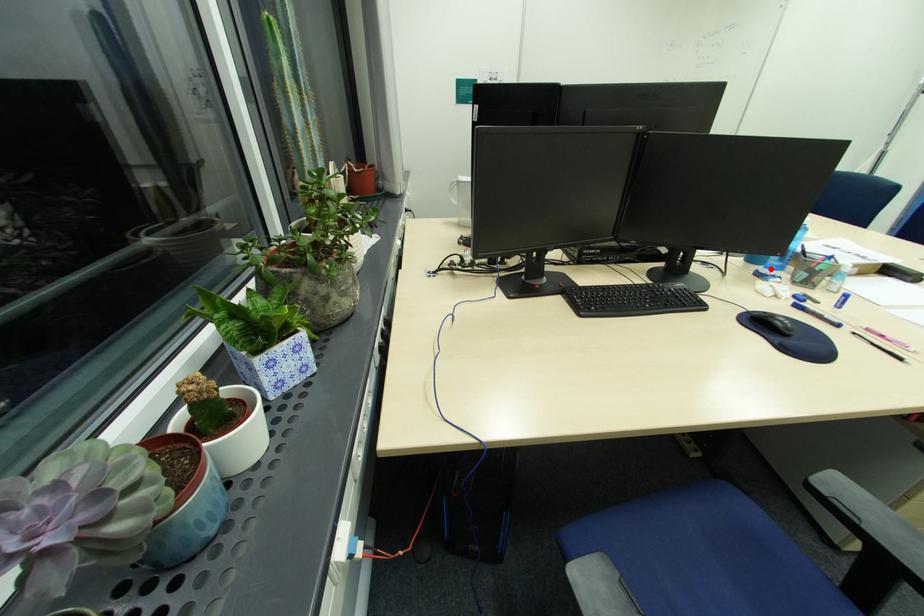
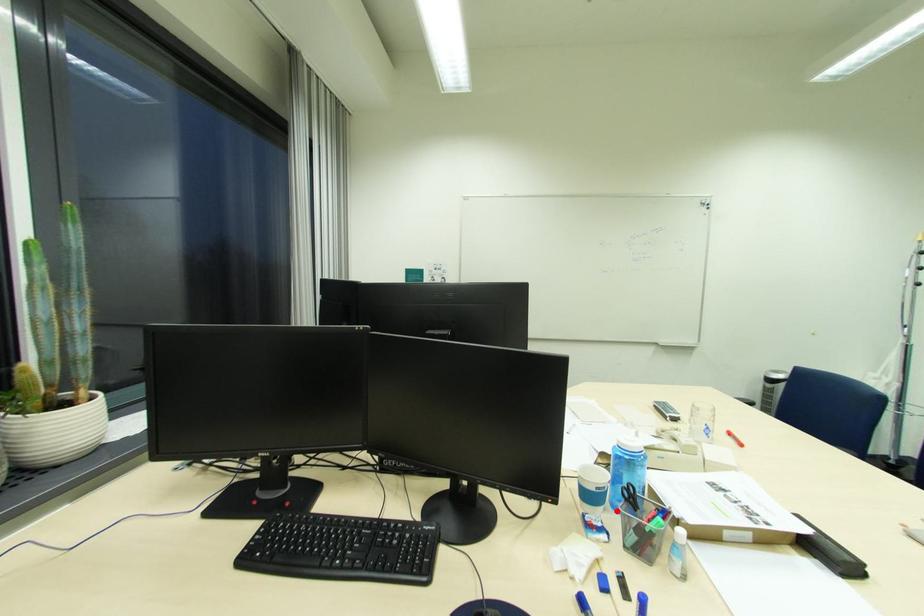
I am providing you with two images of the same scene from different viewpoints. A red point is marked on the first image and another point is marked on the second image. Is the red point in image1 aligned with the point shown in image2?

Yes